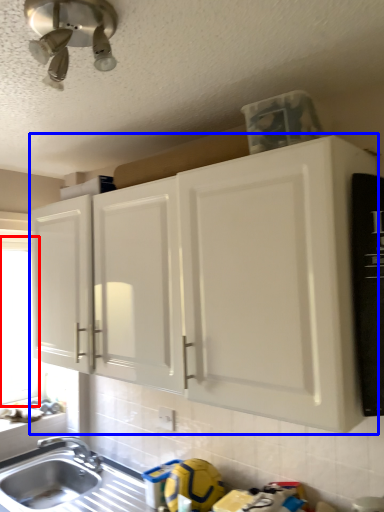
Question: Which object is closer to the camera taking this photo, window screen (highlighted by a red box) or cabinetry (highlighted by a blue box)?

Choices:
 (A) window screen
 (B) cabinetry

Answer: (B)